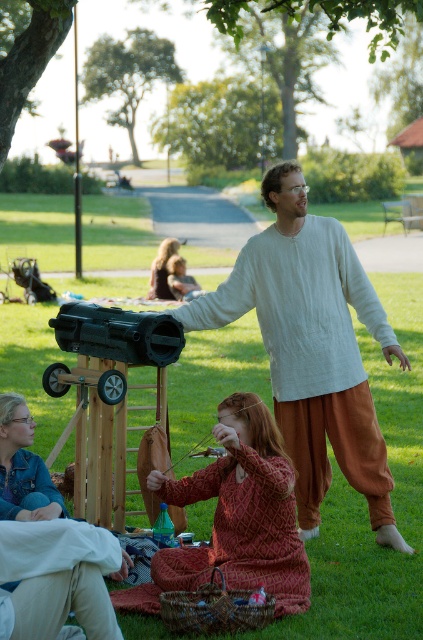
What are the coordinates of the red textured dress at center?

The coordinates of the red textured dress at center are at point [236,516].

You are a photographer standing in the park and want to take a photo of the green grass at center without the denim jacket at lower left appearing in the frame. Is it possible to do so based on their positions?

Yes, since the green grass at center is in front of the denim jacket at lower left, you can position yourself so that the green grass at center blocks the view of the denim jacket at lower left, ensuring it doesn not appear in the photo.